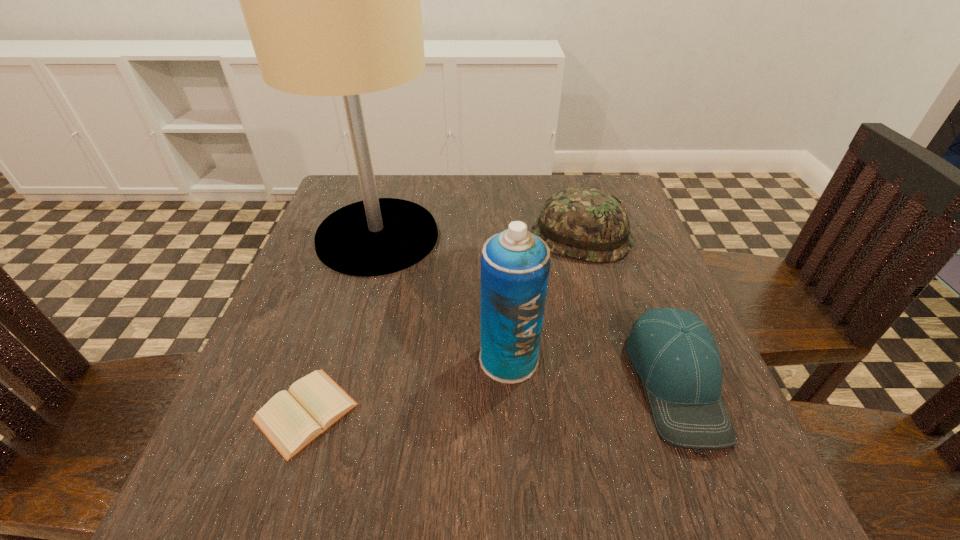
Image resolution: width=960 pixels, height=540 pixels. In order to click on free space between the table lamp and the diary in this screenshot , I will do `click(342, 324)`.

Find the location of a particular element. free space between the diary and the aerosol can is located at coordinates (407, 386).

This screenshot has width=960, height=540. What are the coordinates of `free space between the headwear and the diary` in the screenshot? It's located at (444, 324).

This screenshot has width=960, height=540. In order to click on free space between the table lamp and the third object from right to left in this screenshot , I will do `click(444, 298)`.

Identify which object is the third nearest to the third object from right to left. Please provide its 2D coordinates. Your answer should be formatted as a tuple, i.e. [(x, y)], where the tuple contains the x and y coordinates of a point satisfying the conditions above.

[(290, 421)]

I want to click on object that can be found as the closest to the fourth tallest object, so (x=515, y=264).

The width and height of the screenshot is (960, 540). What are the coordinates of `vacant point that satisfies the following two spatial constraints: 1. on the back side of the headwear; 2. on the right side of the third object from right to left` in the screenshot? It's located at (501, 237).

Identify the location of vacant space that satisfies the following two spatial constraints: 1. on the front side of the table lamp; 2. on the left side of the fourth shortest object. This screenshot has width=960, height=540. (343, 359).

Where is `vacant region that satisfies the following two spatial constraints: 1. on the front side of the tallest object; 2. on the right side of the aerosol can`? vacant region that satisfies the following two spatial constraints: 1. on the front side of the tallest object; 2. on the right side of the aerosol can is located at coordinates (343, 359).